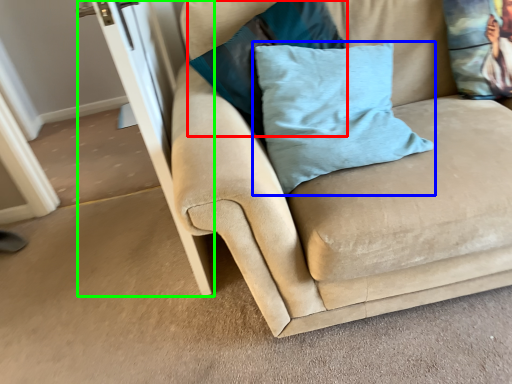
Question: Considering the real-world distances, which object is farthest from pillow (highlighted by a red box)? pillow (highlighted by a blue box) or screen door (highlighted by a green box)?

Choices:
 (A) pillow
 (B) screen door

Answer: (B)